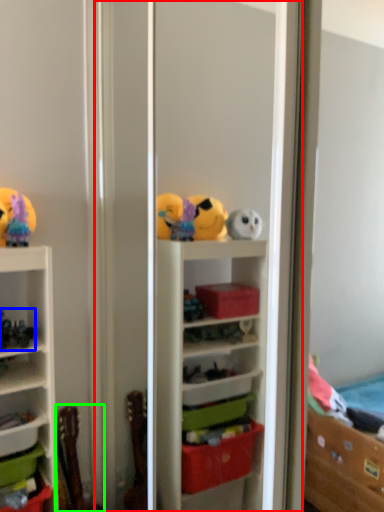
Question: Which object is positioned farthest from screen door (highlighted by a red box)? Select from toy (highlighted by a blue box) and toy (highlighted by a green box).

Choices:
 (A) toy
 (B) toy

Answer: (A)